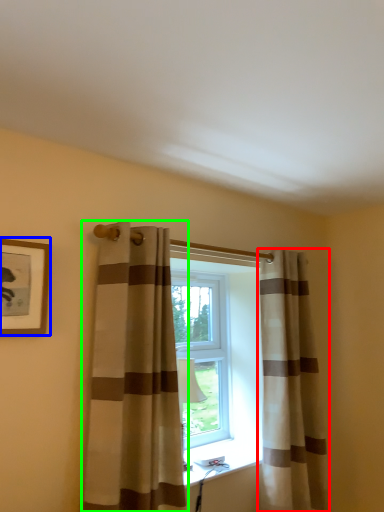
Question: Considering the real-world distances, which object is closest to curtain (highlighted by a red box)? picture frame (highlighted by a blue box) or curtain (highlighted by a green box).

Choices:
 (A) picture frame
 (B) curtain

Answer: (B)